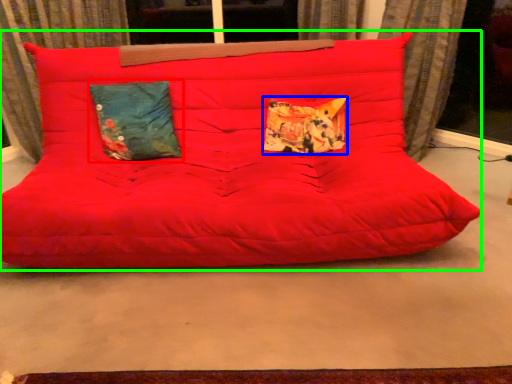
Question: Which object is the closest to the pillow (highlighted by a red box)? Choose among these: pillow (highlighted by a blue box) or studio couch (highlighted by a green box).

Choices:
 (A) pillow
 (B) studio couch

Answer: (B)